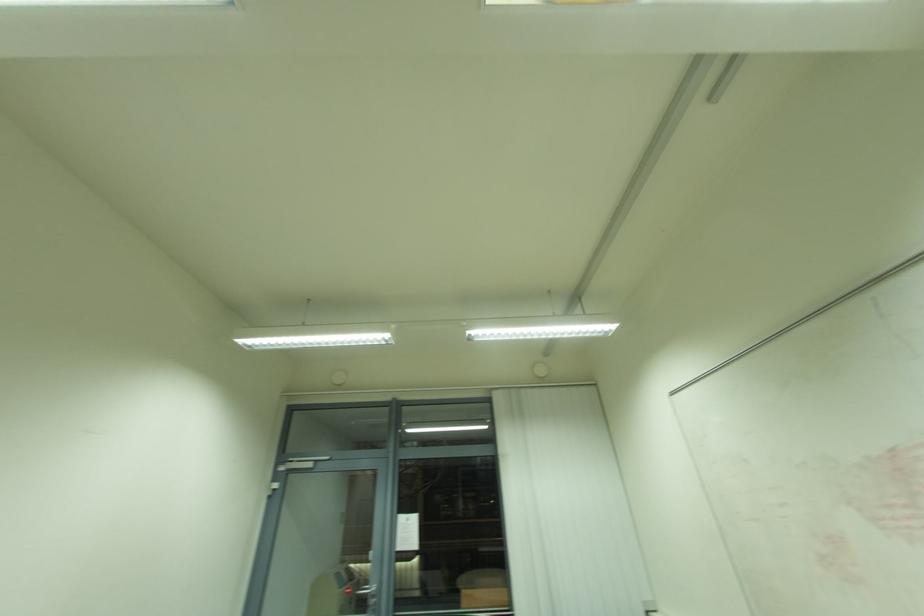
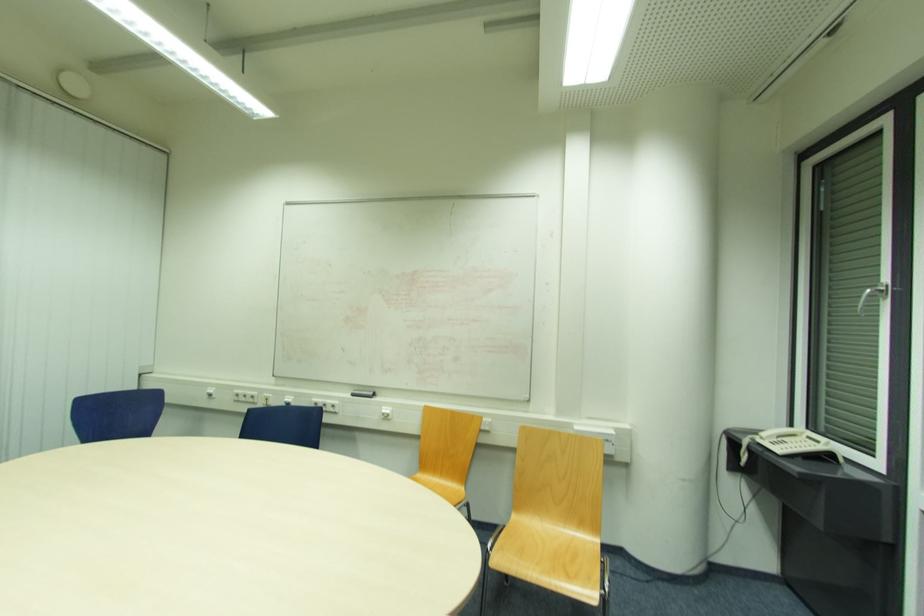
Question: The camera is either moving clockwise (left) or counter-clockwise (right) around the object. The first image is from the beginning of the video and the second image is from the end. Is the camera moving left or right when shooting the video?

Choices:
 (A) Left
 (B) Right

Answer: (A)